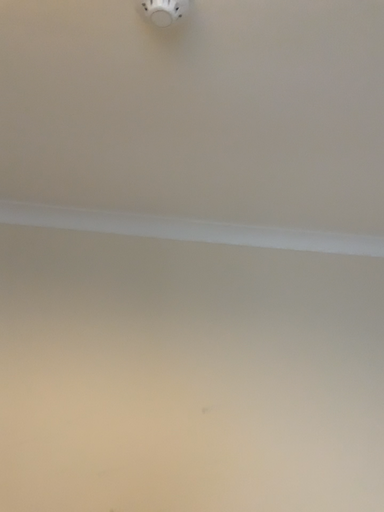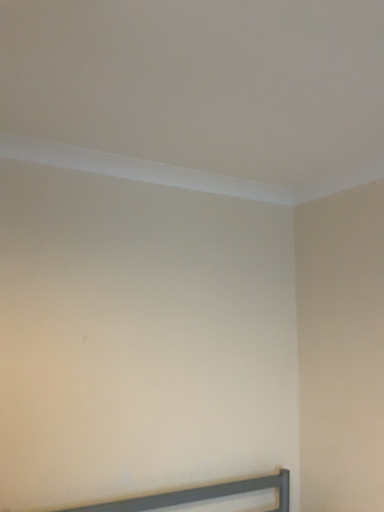
Question: How did the camera likely rotate when shooting the video?

Choices:
 (A) rotated upward
 (B) rotated downward

Answer: (B)